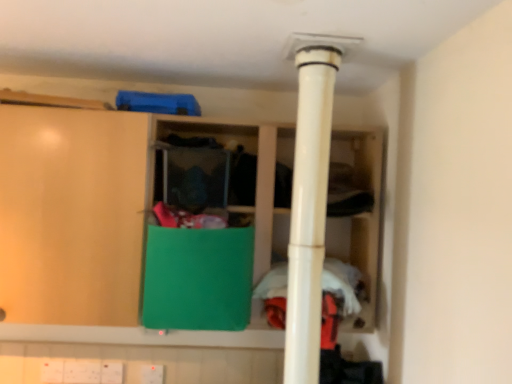
Question: Should I look upward or downward to see white fabric at center?

Choices:
 (A) down
 (B) up

Answer: (A)

Question: Can you confirm if green matte cabinet at center is taller than white fabric at center?

Choices:
 (A) yes
 (B) no

Answer: (A)

Question: Can you confirm if green matte cabinet at center is shorter than white fabric at center?

Choices:
 (A) no
 (B) yes

Answer: (A)

Question: Is green matte cabinet at center facing away from white fabric at center?

Choices:
 (A) no
 (B) yes

Answer: (A)

Question: Does green matte cabinet at center have a smaller size compared to white fabric at center?

Choices:
 (A) no
 (B) yes

Answer: (A)

Question: Considering the relative positions of green matte cabinet at center and white fabric at center in the image provided, is green matte cabinet at center to the left of white fabric at center from the viewer's perspective?

Choices:
 (A) no
 (B) yes

Answer: (B)

Question: Is green matte cabinet at center further to camera compared to white fabric at center?

Choices:
 (A) no
 (B) yes

Answer: (A)

Question: Is white plastic pipe at center closer to camera compared to white fabric at center?

Choices:
 (A) yes
 (B) no

Answer: (A)

Question: Is white plastic pipe at center facing towards white fabric at center?

Choices:
 (A) no
 (B) yes

Answer: (A)

Question: Can you confirm if white plastic pipe at center is positioned to the left of white fabric at center?

Choices:
 (A) yes
 (B) no

Answer: (A)

Question: From a real-world perspective, does white plastic pipe at center sit lower than white fabric at center?

Choices:
 (A) no
 (B) yes

Answer: (A)

Question: Does white plastic pipe at center have a greater width compared to white fabric at center?

Choices:
 (A) yes
 (B) no

Answer: (B)

Question: Is white fabric at center completely or partially inside white plastic pipe at center?

Choices:
 (A) yes
 (B) no

Answer: (B)

Question: Is green matte cabinet at center facing away from white plastic pipe at center?

Choices:
 (A) yes
 (B) no

Answer: (B)